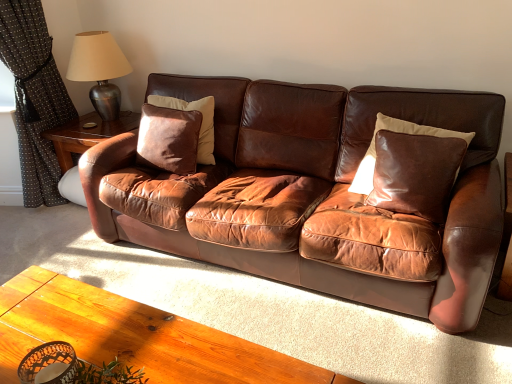
Question: Is shiny brown leather pillow at right, acting as the first pillow starting from the right, located outside metallic silver table lamp at upper left?

Choices:
 (A) yes
 (B) no

Answer: (A)

Question: From the image's perspective, would you say shiny brown leather pillow at right, acting as the first pillow starting from the right, is positioned over metallic silver table lamp at upper left?

Choices:
 (A) yes
 (B) no

Answer: (B)

Question: Considering the relative positions of shiny brown leather pillow at right, which ranks as the 2th pillow in left-to-right order, and metallic silver table lamp at upper left in the image provided, is shiny brown leather pillow at right, which ranks as the 2th pillow in left-to-right order, behind metallic silver table lamp at upper left?

Choices:
 (A) yes
 (B) no

Answer: (B)

Question: From a real-world perspective, is shiny brown leather pillow at right, which ranks as the 2th pillow in left-to-right order, positioned under metallic silver table lamp at upper left based on gravity?

Choices:
 (A) yes
 (B) no

Answer: (A)

Question: From the image's perspective, would you say shiny brown leather pillow at right, acting as the first pillow starting from the right, is shown under metallic silver table lamp at upper left?

Choices:
 (A) yes
 (B) no

Answer: (A)

Question: Does shiny brown leather pillow at right, acting as the first pillow starting from the right, touch metallic silver table lamp at upper left?

Choices:
 (A) yes
 (B) no

Answer: (B)

Question: Can you confirm if metallic silver table lamp at upper left is taller than black dotted fabric at left?

Choices:
 (A) yes
 (B) no

Answer: (B)

Question: From the image's perspective, is metallic silver table lamp at upper left under black dotted fabric at left?

Choices:
 (A) no
 (B) yes

Answer: (A)

Question: Does metallic silver table lamp at upper left appear on the right side of black dotted fabric at left?

Choices:
 (A) yes
 (B) no

Answer: (A)

Question: From a real-world perspective, is metallic silver table lamp at upper left physically below black dotted fabric at left?

Choices:
 (A) no
 (B) yes

Answer: (A)

Question: From the image's perspective, would you say metallic silver table lamp at upper left is positioned over black dotted fabric at left?

Choices:
 (A) yes
 (B) no

Answer: (A)

Question: Is metallic silver table lamp at upper left outside black dotted fabric at left?

Choices:
 (A) no
 (B) yes

Answer: (B)

Question: Is black dotted fabric at left facing away from brown leather couch at center?

Choices:
 (A) yes
 (B) no

Answer: (B)